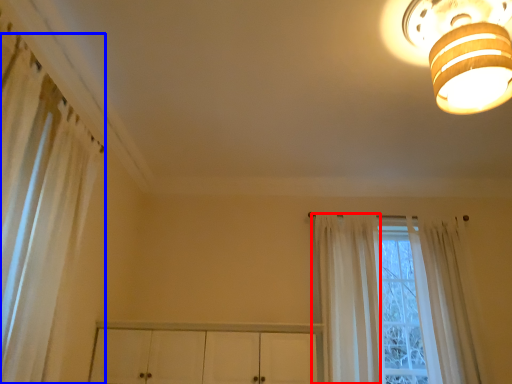
Question: Which point is further to the camera, curtain (highlighted by a red box) or curtain (highlighted by a blue box)?

Choices:
 (A) curtain
 (B) curtain

Answer: (A)